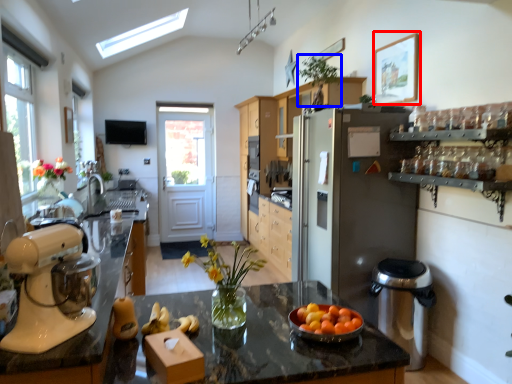
Question: Which object appears closest to the camera in this image, picture frame (highlighted by a red box) or plant (highlighted by a blue box)?

Choices:
 (A) picture frame
 (B) plant

Answer: (A)